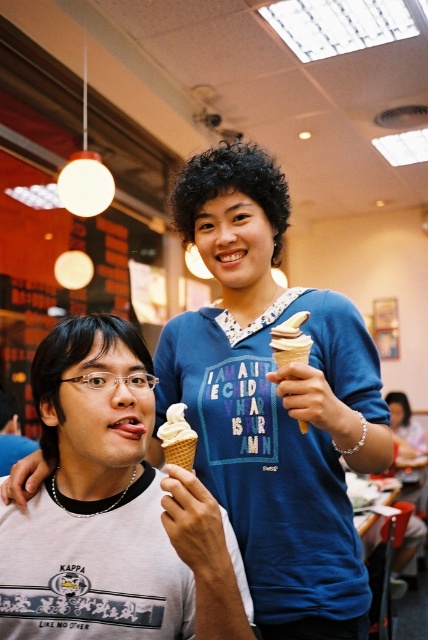
Is white waffle cone ice cream at center wider than white matte ice cream cone at center?

Correct, the width of white waffle cone ice cream at center exceeds that of white matte ice cream cone at center.

Which is more to the left, white waffle cone ice cream at center or white matte ice cream cone at center?

white matte ice cream cone at center is more to the left.

Which is in front, point (190, 362) or point (246, 624)?

Point (246, 624) is in front.

This screenshot has height=640, width=428. I want to click on white waffle cone ice cream at center, so click(x=273, y=403).

In the scene shown: Measure the distance between white matte ice cream cone at center and camera.

31.46 inches

Who is positioned more to the right, white matte ice cream cone at center or vanilla ice cream in waffle cone at center?

vanilla ice cream in waffle cone at center is more to the right.

This screenshot has width=428, height=640. What do you see at coordinates (133, 477) in the screenshot?
I see `white matte ice cream cone at center` at bounding box center [133, 477].

Find the location of `white matte ice cream cone at center`. white matte ice cream cone at center is located at coordinates (133, 477).

This screenshot has height=640, width=428. Find the location of `white matte ice cream cone at center`. white matte ice cream cone at center is located at coordinates (133, 477).

Identify the location of white matte ice cream cone at center. This screenshot has height=640, width=428. (133, 477).

The width and height of the screenshot is (428, 640). Identify the location of white matte ice cream cone at center. (133, 477).